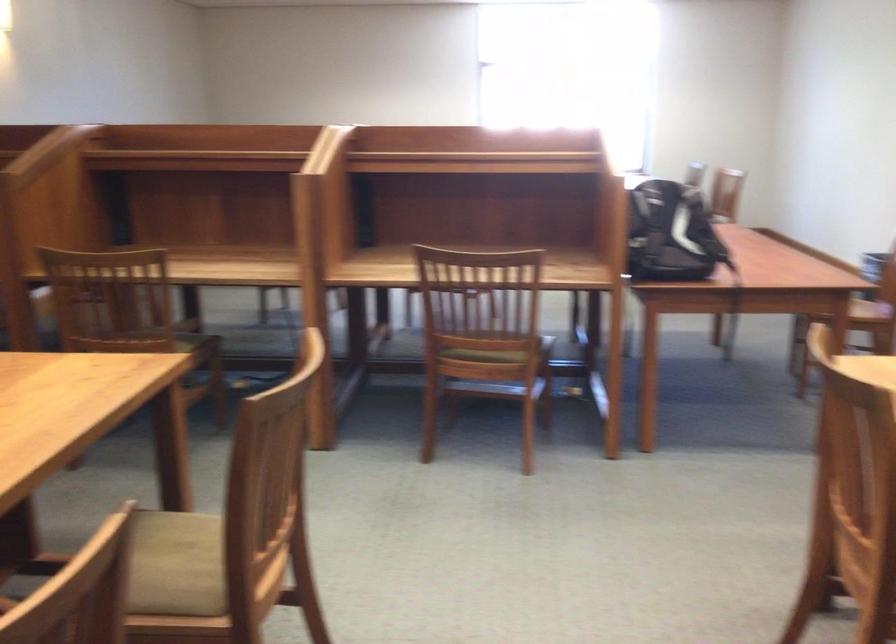
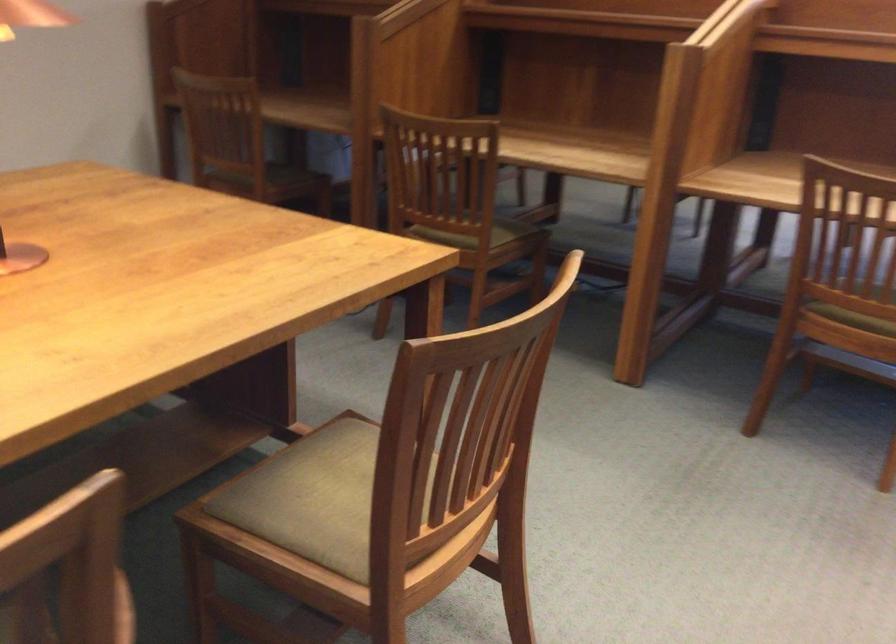
In the second image, find the point that corresponds to [152,352] in the first image.

(474, 234)